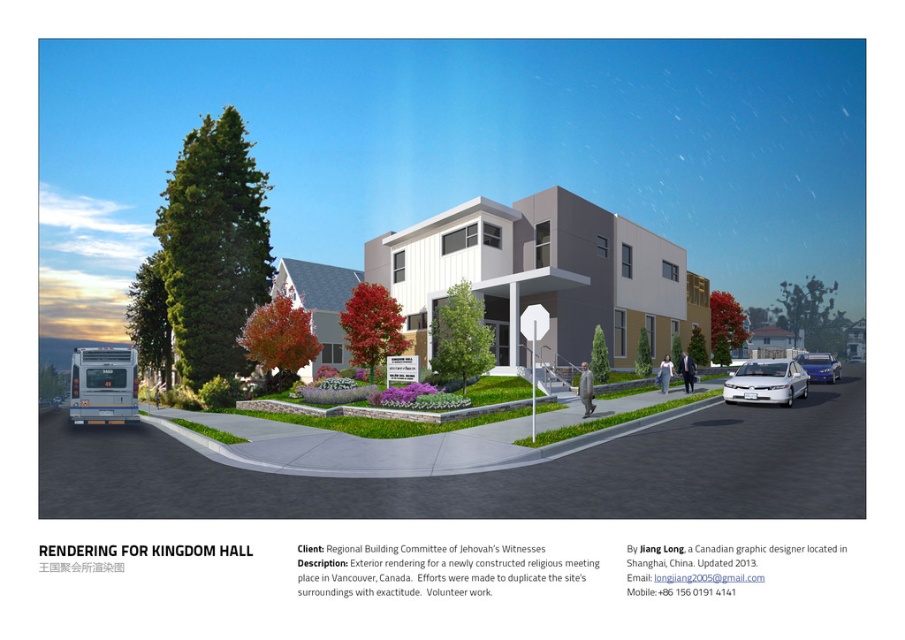
Question: In this image, where is white glossy sedan at lower right located relative to white glossy sedan at right?

Choices:
 (A) left
 (B) right

Answer: (A)

Question: Estimate the real-world distances between objects in this image. Which object is farther from the silver metallic bus at lower left?

Choices:
 (A) white glossy sedan at lower right
 (B) white glossy sedan at right

Answer: (B)

Question: Considering the real-world distances, which object is farthest from the white glossy sedan at right?

Choices:
 (A) white glossy sedan at lower right
 (B) silver metallic bus at lower left

Answer: (B)

Question: From the image, what is the correct spatial relationship of silver metallic bus at lower left in relation to white glossy sedan at lower right?

Choices:
 (A) right
 (B) left

Answer: (B)

Question: Does silver metallic bus at lower left have a greater width compared to white glossy sedan at right?

Choices:
 (A) no
 (B) yes

Answer: (A)

Question: Which point is closer to the camera?

Choices:
 (A) silver metallic bus at lower left
 (B) white glossy sedan at right
 (C) white glossy sedan at lower right

Answer: (A)